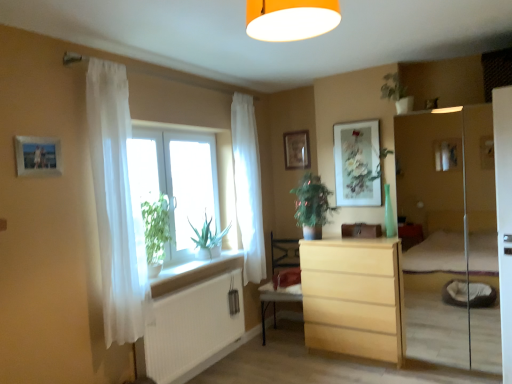
Question: Considering the relative sizes of white sheer curtain at window, which is the first curtain in back-to-front order, and light wood chest of drawers at center in the image provided, is white sheer curtain at window, which is the first curtain in back-to-front order, thinner than light wood chest of drawers at center?

Choices:
 (A) no
 (B) yes

Answer: (B)

Question: Is white sheer curtain at window, positioned as the first curtain in right-to-left order, oriented away from light wood chest of drawers at center?

Choices:
 (A) yes
 (B) no

Answer: (B)

Question: Can you confirm if white sheer curtain at window, acting as the 2th curtain starting from the front, is shorter than light wood chest of drawers at center?

Choices:
 (A) yes
 (B) no

Answer: (B)

Question: Is white sheer curtain at window, positioned as the first curtain in right-to-left order, further to camera compared to light wood chest of drawers at center?

Choices:
 (A) yes
 (B) no

Answer: (A)

Question: Is white sheer curtain at window, acting as the 2th curtain starting from the front, in contact with light wood chest of drawers at center?

Choices:
 (A) no
 (B) yes

Answer: (A)

Question: Is transparent glass window at center in front of or behind green leafy plant at center in the image?

Choices:
 (A) front
 (B) behind

Answer: (A)

Question: Does point (174, 231) appear closer or farther from the camera than point (303, 195)?

Choices:
 (A) closer
 (B) farther

Answer: (B)

Question: Is transparent glass window at center wider or thinner than green leafy plant at center?

Choices:
 (A) thin
 (B) wide

Answer: (A)

Question: Is transparent glass window at center inside or outside of green leafy plant at center?

Choices:
 (A) inside
 (B) outside

Answer: (B)

Question: Is point (339, 165) positioned closer to the camera than point (395, 77)?

Choices:
 (A) closer
 (B) farther

Answer: (B)

Question: Is matte floral artwork at upper center, the 2th picture frame viewed from the front, taller or shorter than green matte plant at upper center?

Choices:
 (A) short
 (B) tall

Answer: (B)

Question: In terms of width, does matte floral artwork at upper center, which is counted as the 2th picture frame, starting from the back, look wider or thinner when compared to green matte plant at upper center?

Choices:
 (A) thin
 (B) wide

Answer: (A)

Question: Based on their sizes in the image, would you say matte floral artwork at upper center, the 2th picture frame viewed from the front, is bigger or smaller than green matte plant at upper center?

Choices:
 (A) big
 (B) small

Answer: (B)

Question: Would you say matte floral artwork at upper center, which is counted as the first picture frame, starting from the right, is to the left or to the right of white sheer curtain at window, which is the second curtain in left-to-right order, in the picture?

Choices:
 (A) left
 (B) right

Answer: (B)

Question: Relative to white sheer curtain at window, which is the second curtain in left-to-right order, is matte floral artwork at upper center, the 3th picture frame when ordered from left to right, in front or behind?

Choices:
 (A) behind
 (B) front

Answer: (A)